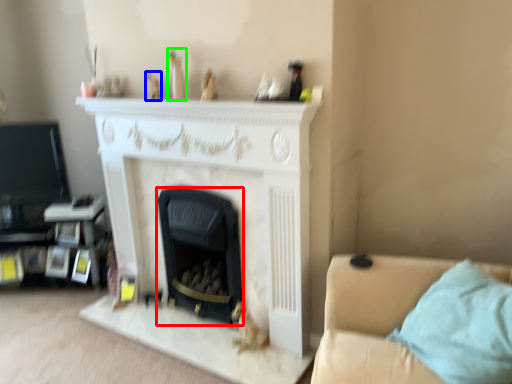
Question: Estimate the real-world distances between objects in this image. Which object is farther from fireplace (highlighted by a red box), toy (highlighted by a blue box) or toy (highlighted by a green box)?

Choices:
 (A) toy
 (B) toy

Answer: (A)